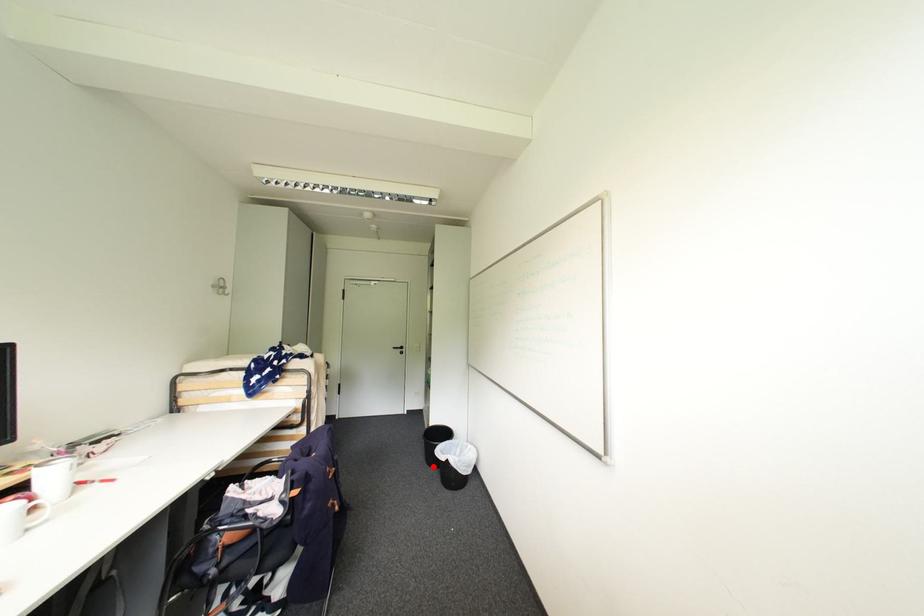
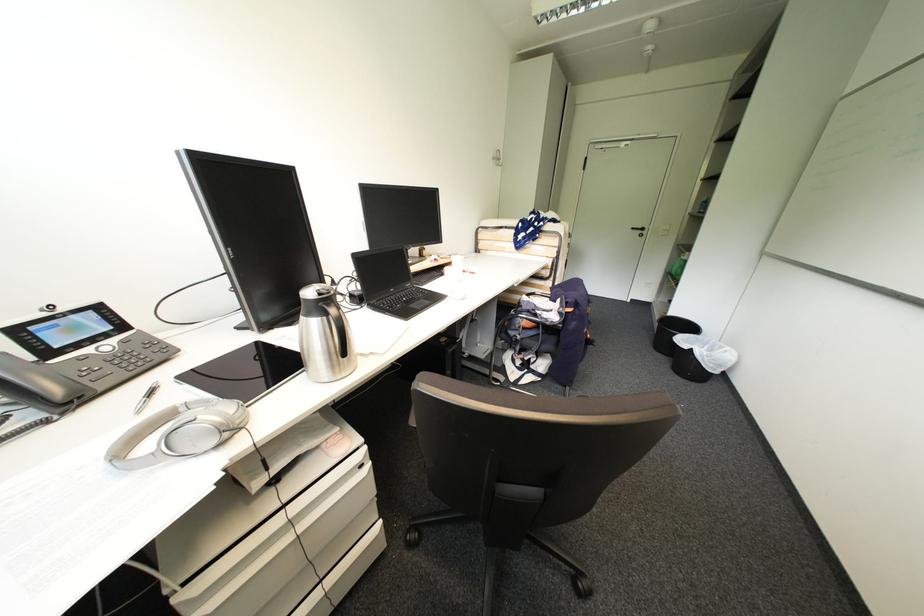
Question: I am providing you with two images of the same scene from different viewpoints. In image1, a red point is highlighted. Considering the same 3D point in image2, which of the following is correct?

Choices:
 (A) It is closer
 (B) It is farther

Answer: (A)